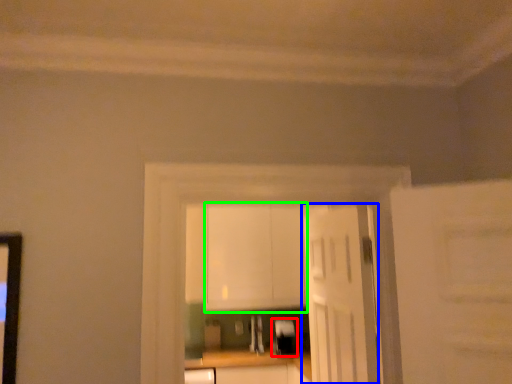
Question: Based on their relative distances, which object is nearer to appliance (highlighted by a red box)? Choose from door (highlighted by a blue box) and cabinetry (highlighted by a green box).

Choices:
 (A) door
 (B) cabinetry

Answer: (B)